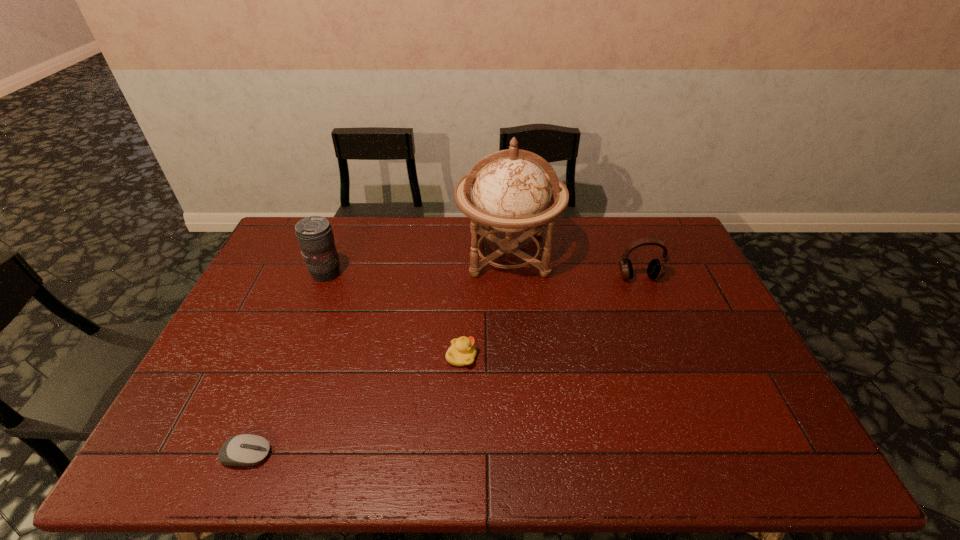
Image resolution: width=960 pixels, height=540 pixels. What are the coordinates of `blank space at the left edge of the desktop` in the screenshot? It's located at (290, 256).

Identify the location of free space at the far right corner of the desktop. (679, 235).

Locate an element on the screen. The image size is (960, 540). free space between the computer equipment and the telephoto lens is located at coordinates (286, 364).

In order to click on free space between the globe and the computer equipment in this screenshot , I will do `click(377, 354)`.

Find the location of `unoccupied position between the telephoto lens and the second shortest object`. unoccupied position between the telephoto lens and the second shortest object is located at coordinates (394, 315).

The image size is (960, 540). In order to click on free space between the fourth shortest object and the second shortest object in this screenshot , I will do `click(394, 315)`.

In order to click on vacant area between the headset and the telephoto lens in this screenshot , I will do `click(483, 275)`.

Identify the location of vacant region between the second shortest object and the fourth shortest object. The height and width of the screenshot is (540, 960). (394, 315).

I want to click on free space between the computer equipment and the globe, so click(377, 354).

Identify the location of vacant area that lies between the duckling and the tallest object. The height and width of the screenshot is (540, 960). (485, 305).